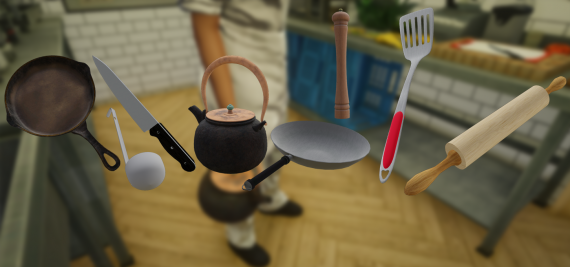
Locate an element on the screen. kettle is located at coordinates (242, 137).